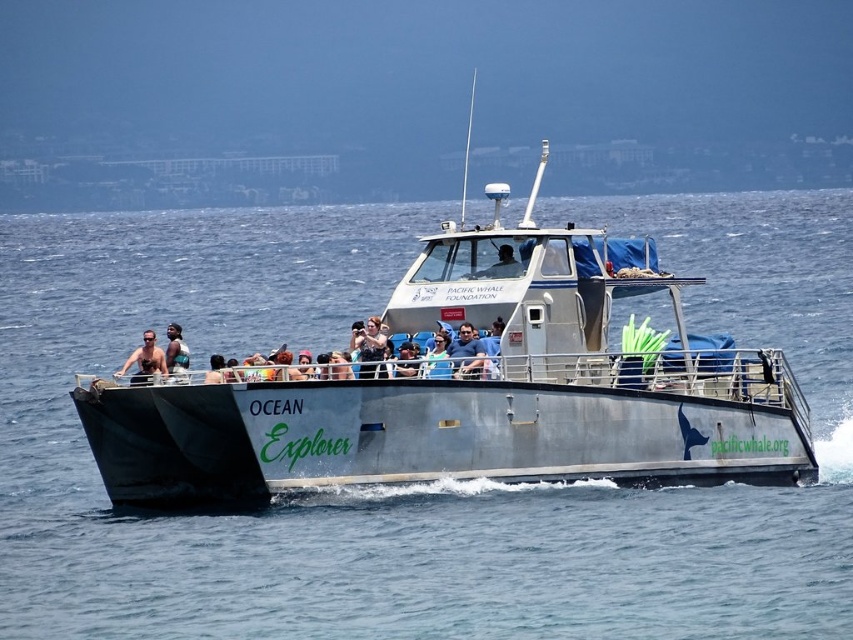
Question: Which point is farther to the camera?

Choices:
 (A) (160, 371)
 (B) (170, 348)
 (C) (479, 362)

Answer: (B)

Question: Can you confirm if blue fabric shirt at center is positioned to the left of matte black shirt at center?

Choices:
 (A) no
 (B) yes

Answer: (A)

Question: Is metallic gray boat at center positioned behind tan skin person at center?

Choices:
 (A) yes
 (B) no

Answer: (B)

Question: Among these objects, which one is nearest to the camera?

Choices:
 (A) tan skin person at center
 (B) metallic gray boat at center
 (C) blue fabric shirt at center

Answer: (B)

Question: Is blue fabric shirt at center closer to camera compared to matte black shirt at center?

Choices:
 (A) no
 (B) yes

Answer: (B)

Question: Which of these objects is positioned farthest from the metallic gray boat at center?

Choices:
 (A) tan skin person at center
 (B) matte black shirt at center

Answer: (B)